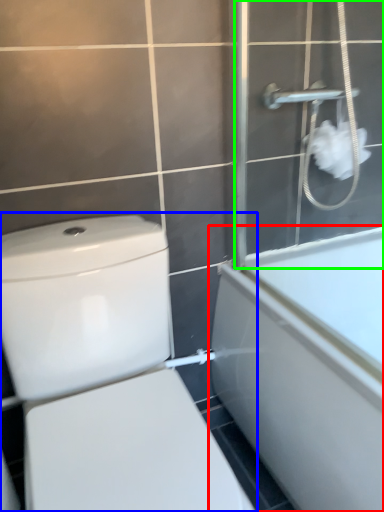
Question: Which is nearer to the bathtub (highlighted by a red box)? toilet (highlighted by a blue box) or screen door (highlighted by a green box).

Choices:
 (A) toilet
 (B) screen door

Answer: (B)